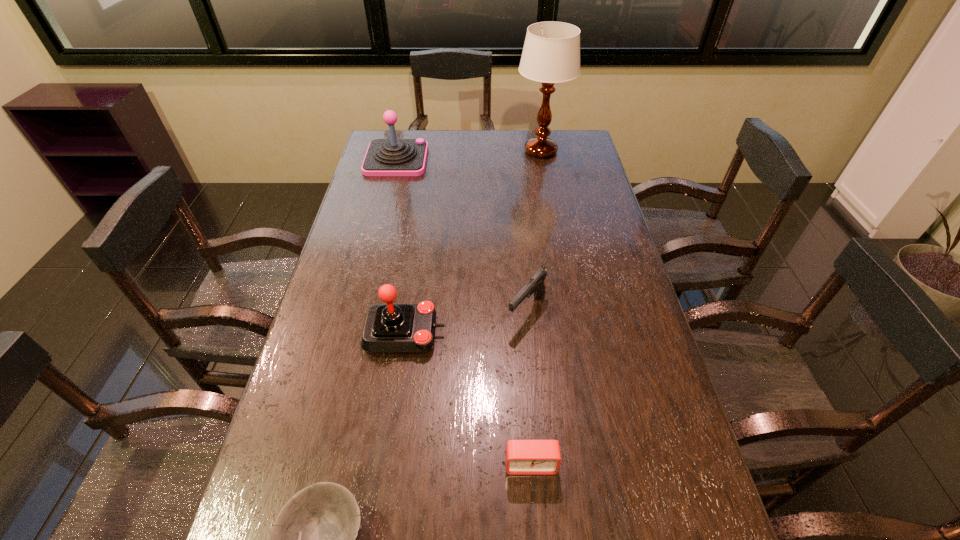
What are the coordinates of `free area in between the fifth farthest object and the nearer joystick` in the screenshot? It's located at (468, 399).

You are a GUI agent. You are given a task and a screenshot of the screen. Output one action in this format:
    pyautogui.click(x=<x>, y=<y>)
    Task: Click on the vacant area that lies between the table lamp and the farther joystick
    
    Given the screenshot: What is the action you would take?
    pos(468,156)

You are a GUI agent. You are given a task and a screenshot of the screen. Output one action in this format:
    pyautogui.click(x=<x>, y=<y>)
    Task: Click on the free space between the alarm clock and the nearer joystick
    
    Given the screenshot: What is the action you would take?
    click(x=468, y=399)

I want to click on object that stands as the second closest to the bowl, so click(389, 328).

Identify which object is located as the nearest to the gun. Please provide its 2D coordinates. Your answer should be formatted as a tuple, i.e. [(x, y)], where the tuple contains the x and y coordinates of a point satisfying the conditions above.

[(389, 328)]

This screenshot has height=540, width=960. Find the location of `vacant space that satisfies the following two spatial constraints: 1. on the front side of the table lamp; 2. forward from the base of the farther joystick`. vacant space that satisfies the following two spatial constraints: 1. on the front side of the table lamp; 2. forward from the base of the farther joystick is located at coordinates (542, 160).